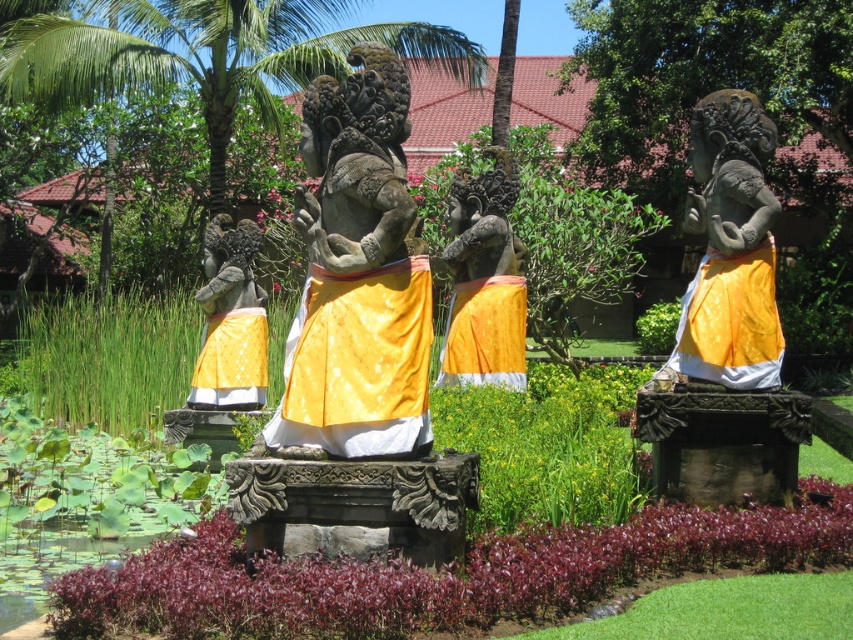
You are a visitor in the garden and want to take a photo of both the polished stone statue at center and the matte stone statue at right. Which statue should you stand closer to in order to include both in your camera frame?

Since the polished stone statue at center is shorter than the matte stone statue at right, you should stand closer to the polished stone statue at center to ensure both are visible in the frame.

You are a landscape architect designing a pathway between the green leafy palm tree at center and the shiny gold statue at center. Which object requires more space to accommodate on either side due to its width?

The shiny gold statue at center requires more space because its width is greater than the green leafy palm tree at center.